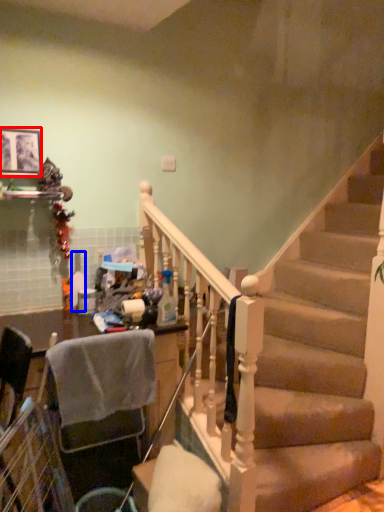
Question: Which object appears farthest to the camera in this image, picture frame (highlighted by a red box) or bottle (highlighted by a blue box)?

Choices:
 (A) picture frame
 (B) bottle

Answer: (B)